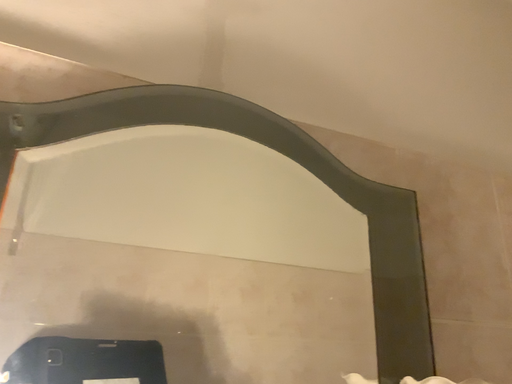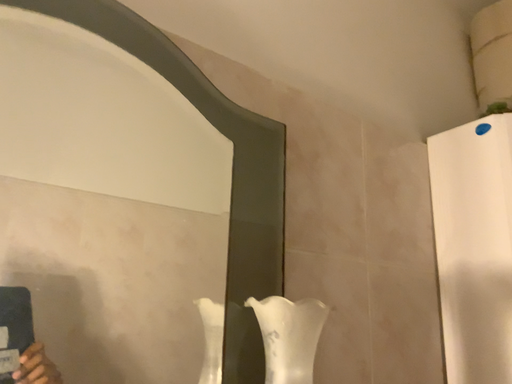
Question: How did the camera likely rotate when shooting the video?

Choices:
 (A) rotated downward
 (B) rotated upward

Answer: (A)